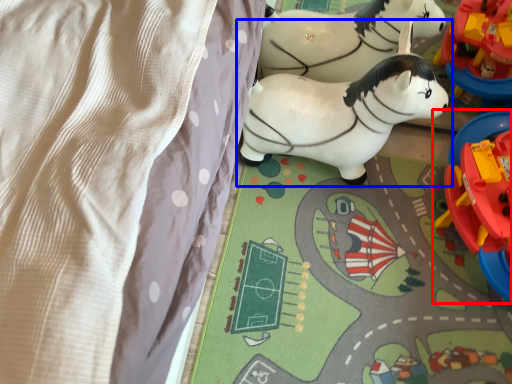
Question: Which object appears closest to the camera in this image, toy (highlighted by a red box) or toy (highlighted by a blue box)?

Choices:
 (A) toy
 (B) toy

Answer: (A)